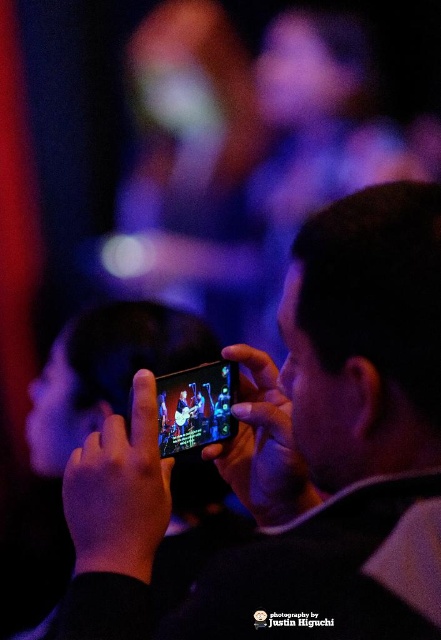
Question: From the image, what is the correct spatial relationship of black matte phone at center in relation to black glossy smartphone at center?

Choices:
 (A) below
 (B) above

Answer: (B)

Question: Which of the following is the farthest from the observer?

Choices:
 (A) black matte phone at center
 (B) black glossy smartphone at center

Answer: (B)

Question: Is black matte phone at center bigger than black glossy smartphone at center?

Choices:
 (A) no
 (B) yes

Answer: (B)

Question: Does black matte phone at center appear over black glossy smartphone at center?

Choices:
 (A) no
 (B) yes

Answer: (B)